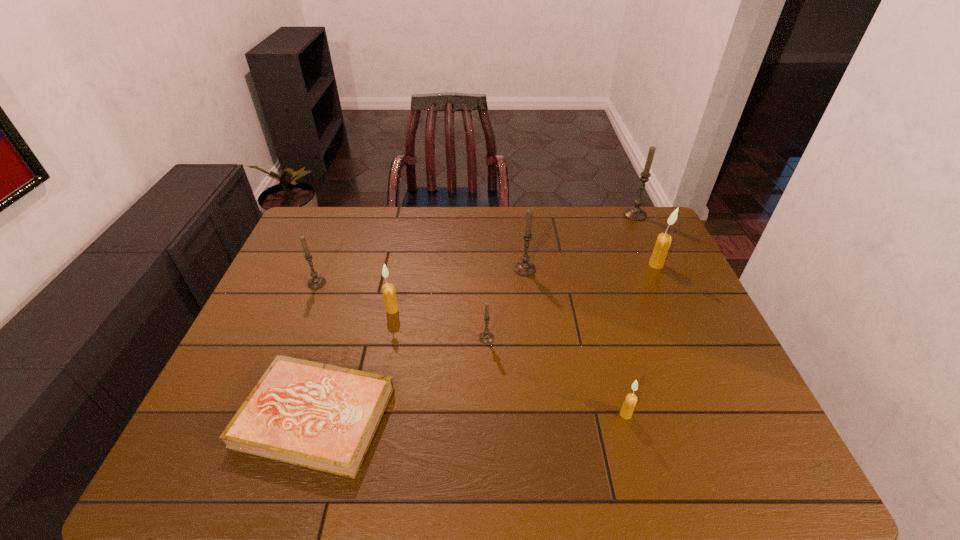
You are a GUI agent. You are given a task and a screenshot of the screen. Output one action in this format:
    pyautogui.click(x=<x>, y=<y>)
    Task: Click on the vacant space that's between the second gray candle from right to left and the farthest candle
    
    Given the screenshot: What is the action you would take?
    pyautogui.click(x=580, y=242)

This screenshot has height=540, width=960. In order to click on free spot between the sixth farthest candle and the biggest cream candle in this screenshot , I will do `click(571, 301)`.

This screenshot has height=540, width=960. In order to click on unoccupied position between the fifth object from left to right and the leftmost gray candle in this screenshot , I will do `click(420, 276)`.

The height and width of the screenshot is (540, 960). Identify the location of vacant space that's between the smallest gray candle and the hardback book. (401, 377).

Locate an element on the screen. free area in between the biggest cream candle and the third smallest gray candle is located at coordinates (590, 267).

You are a GUI agent. You are given a task and a screenshot of the screen. Output one action in this format:
    pyautogui.click(x=<x>, y=<y>)
    Task: Click on the closest object to the biggest cream candle
    This screenshot has width=960, height=540.
    Given the screenshot: What is the action you would take?
    pyautogui.click(x=635, y=213)

Identify which object is the sixth closest to the third nearest candle. Please provide its 2D coordinates. Your answer should be formatted as a tuple, i.e. [(x, y)], where the tuple contains the x and y coordinates of a point satisfying the conditions above.

[(663, 242)]

Locate an element on the screen. the fourth closest candle to the fifth nearest object is located at coordinates (629, 404).

Image resolution: width=960 pixels, height=540 pixels. Identify the location of the second closest candle to the fourth object from left to right. (389, 293).

Identify the location of gray candle identified as the closest to the tallest object. The width and height of the screenshot is (960, 540). (524, 268).